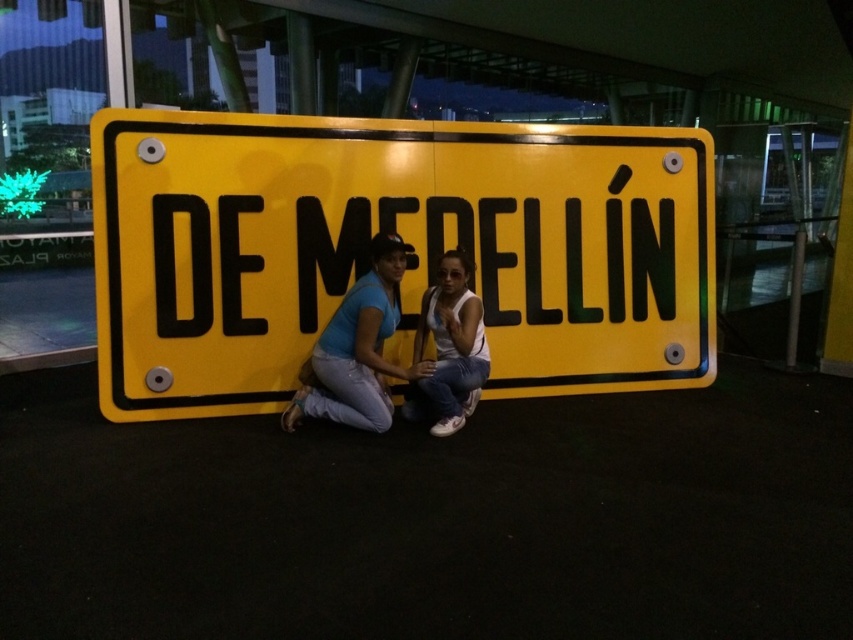
Is point (412, 364) farther from viewer compared to point (473, 396)?

Yes, point (412, 364) is farther from viewer.

Who is shorter, matte black clothing at center or white matte tank top at center?

white matte tank top at center is shorter.

What do you see at coordinates (358, 349) in the screenshot?
I see `matte black clothing at center` at bounding box center [358, 349].

Locate an element on the screen. Image resolution: width=853 pixels, height=640 pixels. matte black clothing at center is located at coordinates (358, 349).

Is point (595, 376) positioned after point (469, 342)?

Yes, point (595, 376) is behind point (469, 342).

Image resolution: width=853 pixels, height=640 pixels. Find the location of `yellow metallic sign at center`. yellow metallic sign at center is located at coordinates (405, 241).

Is point (160, 282) in front of point (444, 417)?

No, (160, 282) is further to viewer.

Is yellow metallic sign at center positioned behind white matte tank top at center?

Yes.

Is point (216, 362) more distant than point (453, 253)?

Yes.

Locate an element on the screen. The image size is (853, 640). yellow metallic sign at center is located at coordinates (405, 241).